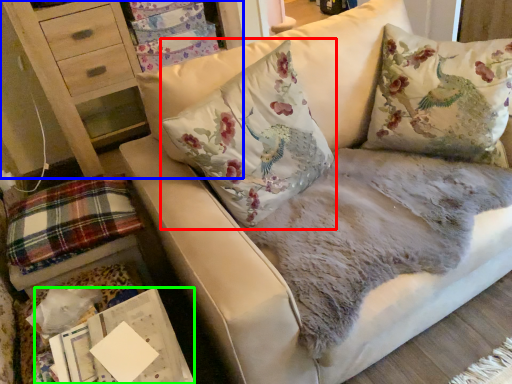
Question: Estimate the real-world distances between objects in this image. Which object is closer to pillow (highlighted by a red box), furniture (highlighted by a blue box) or magazine (highlighted by a green box)?

Choices:
 (A) furniture
 (B) magazine

Answer: (B)